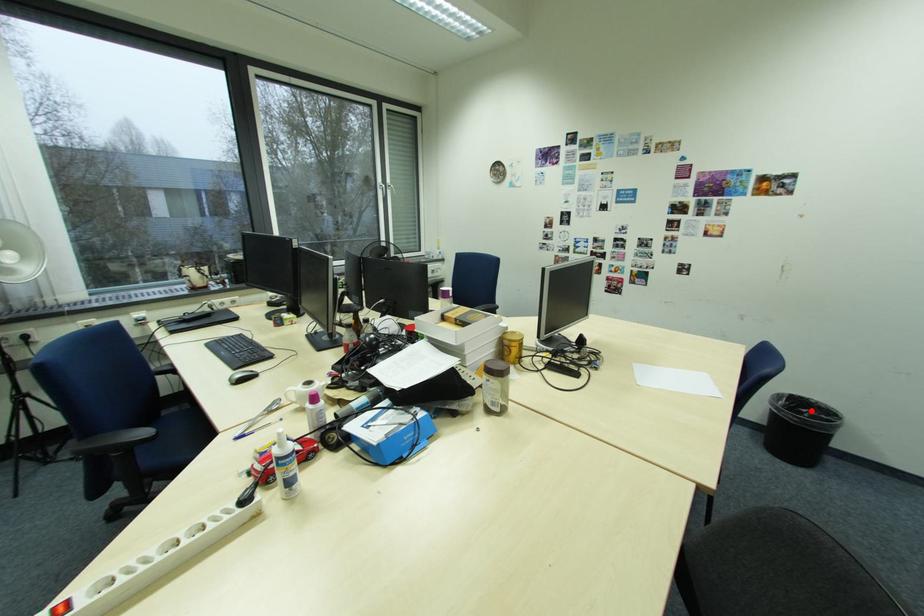
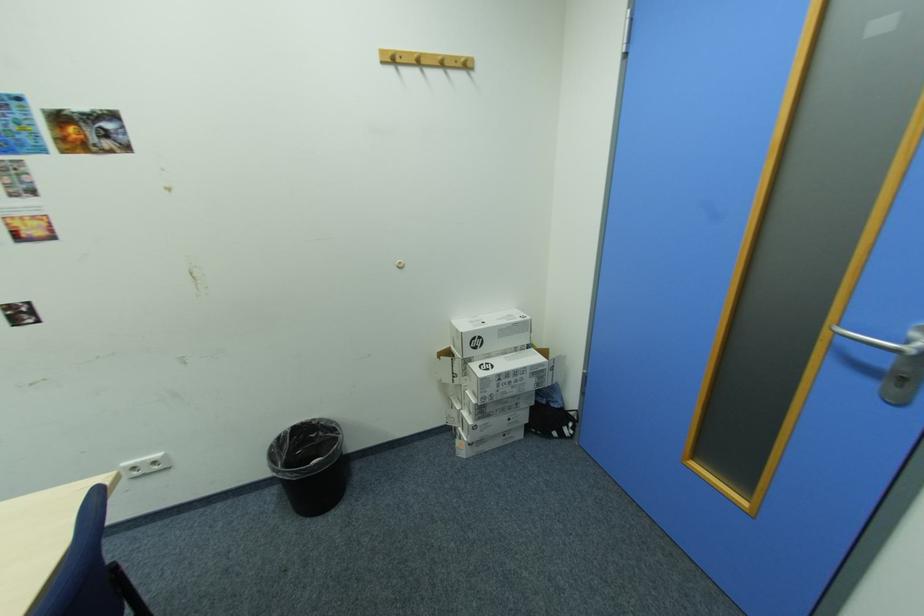
Question: I am providing you with two images of the same scene from different viewpoints. In image1, a red point is highlighted. Considering the same 3D point in image2, which of the following is correct?

Choices:
 (A) It is closer
 (B) It is farther

Answer: (B)